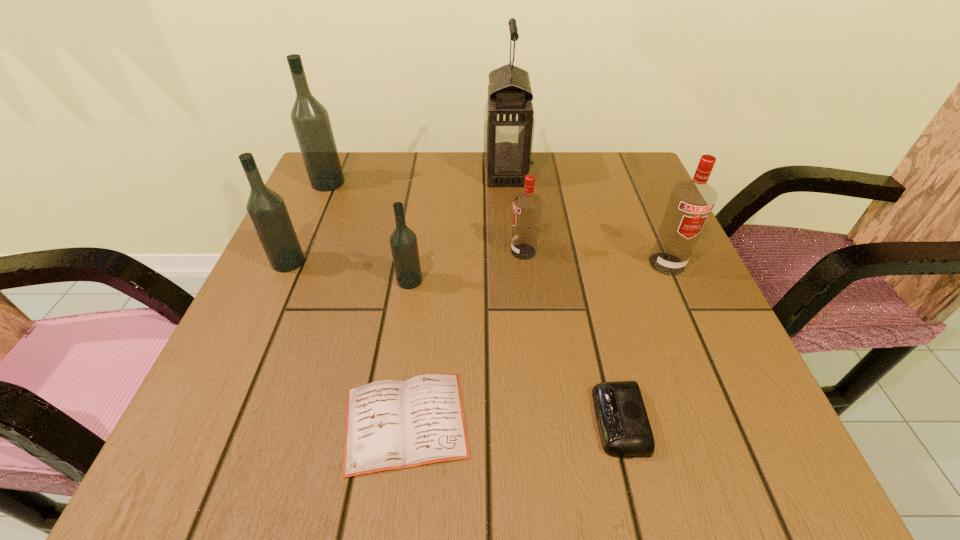
Where is `gray lantern`? gray lantern is located at coordinates (509, 120).

This screenshot has width=960, height=540. I want to click on the biggest black vodka, so click(310, 119).

This screenshot has height=540, width=960. I want to click on the seventh shortest object, so pyautogui.click(x=310, y=119).

Identify the location of the second smallest black vodka. The image size is (960, 540). (267, 211).

Locate an element on the screen. The height and width of the screenshot is (540, 960). the rightmost object is located at coordinates (691, 202).

Identify the location of the bigger red vodka. The width and height of the screenshot is (960, 540). (691, 202).

The height and width of the screenshot is (540, 960). In order to click on the left red vodka in this screenshot , I will do pyautogui.click(x=527, y=206).

In order to click on the second vodka from right to left in this screenshot , I will do `click(527, 206)`.

Find the location of `the rightmost black vodka`. the rightmost black vodka is located at coordinates (403, 241).

Locate an element on the screen. This screenshot has width=960, height=540. the smallest black vodka is located at coordinates (403, 241).